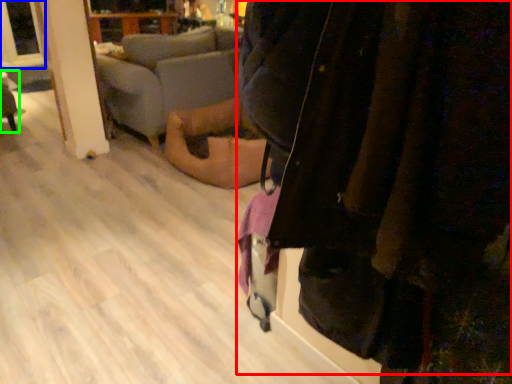
Question: Considering the real-world distances, which object is farthest from jacket (highlighted by a red box)? window screen (highlighted by a blue box) or furniture (highlighted by a green box)?

Choices:
 (A) window screen
 (B) furniture

Answer: (B)